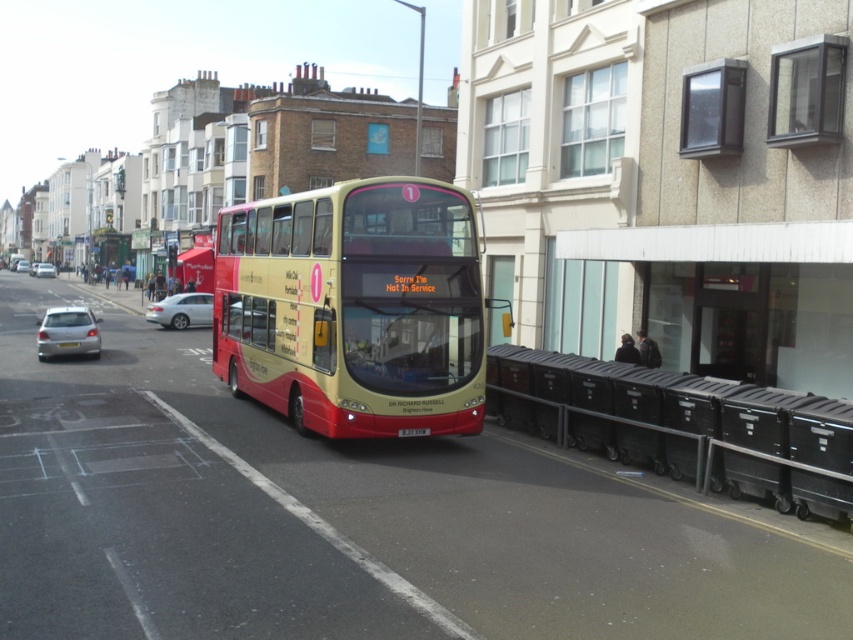
Does matte gold-decked bus at center have a lesser height compared to satin silver sedan at center?

No.

Between point (280, 365) and point (201, 301), which one is positioned in front?

Point (280, 365)

Locate an element on the screen. Image resolution: width=853 pixels, height=640 pixels. matte gold-decked bus at center is located at coordinates (352, 307).

The width and height of the screenshot is (853, 640). I want to click on matte gold-decked bus at center, so click(352, 307).

Can you confirm if black plastic license plate at center is taller than yellow plastic license plate at center?

No, black plastic license plate at center is not taller than yellow plastic license plate at center.

Does point (405, 428) come farther from viewer compared to point (57, 346)?

No, it is in front of (57, 346).

The width and height of the screenshot is (853, 640). What do you see at coordinates (413, 432) in the screenshot? I see `black plastic license plate at center` at bounding box center [413, 432].

Find the location of `black plastic license plate at center`. black plastic license plate at center is located at coordinates (413, 432).

How distant is silver metallic hatchback at lower left from yellow plastic license plate at center?

silver metallic hatchback at lower left and yellow plastic license plate at center are 2.52 meters apart.

Is silver metallic hatchback at lower left in front of yellow plastic license plate at center?

No.

Which is behind, point (57, 339) or point (59, 342)?

Point (57, 339)

This screenshot has width=853, height=640. Identify the location of silver metallic hatchback at lower left. (67, 332).